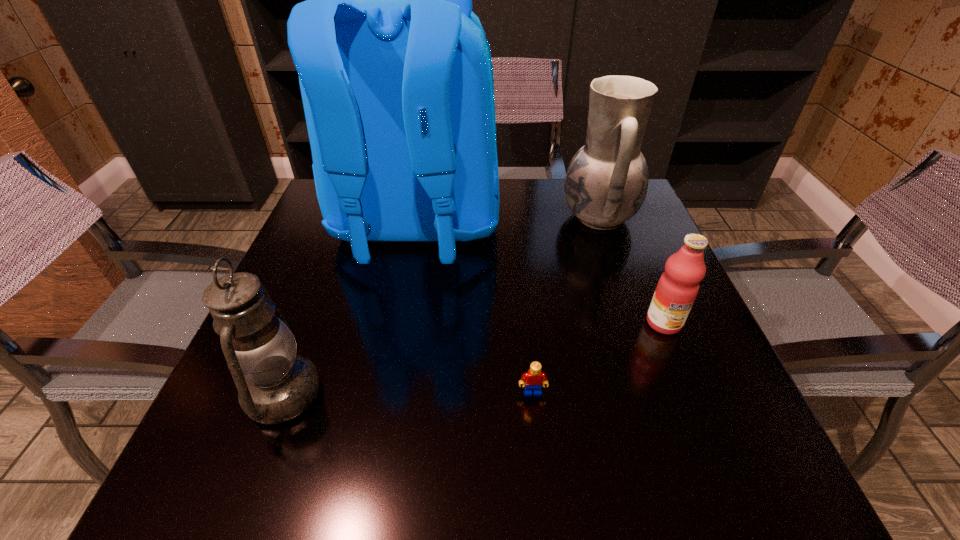
Select which object is the closest to the third nearest object. Please provide its 2D coordinates. Your answer should be formatted as a tuple, i.e. [(x, y)], where the tuple contains the x and y coordinates of a point satisfying the conditions above.

[(606, 183)]

Locate an element on the screen. The image size is (960, 540). free space in the image that satisfies the following two spatial constraints: 1. on the front-facing side of the pitcher; 2. on the back of the tallest object is located at coordinates (602, 226).

The height and width of the screenshot is (540, 960). In order to click on blank space that satisfies the following two spatial constraints: 1. on the front-facing side of the pitcher; 2. on the front-facing side of the third object from right to left in this screenshot , I will do `click(660, 393)`.